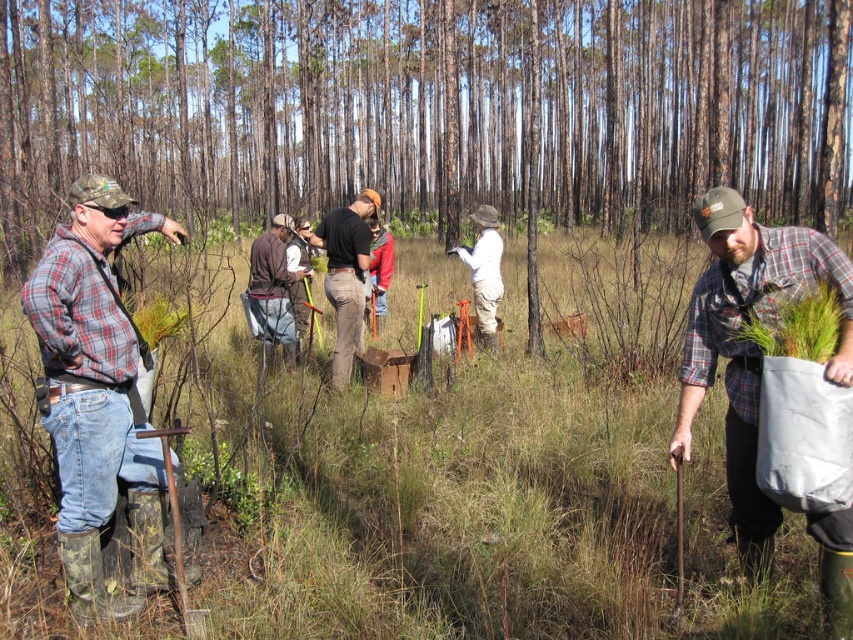
Which of these two, brown wood tree at center or brown leather vest at center, stands shorter?

brown leather vest at center

Can you confirm if brown wood tree at center is bigger than brown leather vest at center?

Correct, brown wood tree at center is larger in size than brown leather vest at center.

Is point (763, 49) farther from camera compared to point (274, 243)?

Yes.

This screenshot has width=853, height=640. I want to click on brown wood tree at center, so click(427, 108).

Which is in front, point (326, 256) or point (296, 358)?

Point (326, 256)

How far apart are brown leather pants at center and brown leather vest at center?

A distance of 31.74 inches exists between brown leather pants at center and brown leather vest at center.

What do you see at coordinates (346, 275) in the screenshot?
I see `brown leather pants at center` at bounding box center [346, 275].

Identify the location of brown leather pants at center. [x=346, y=275].

Who is more forward, (x=840, y=371) or (x=355, y=292)?

Point (x=840, y=371) is more forward.

Based on the photo, is plaid flannel shirt at center shorter than brown leather pants at center?

Indeed, plaid flannel shirt at center has a lesser height compared to brown leather pants at center.

Between point (729, 378) and point (341, 305), which one is positioned in front?

Point (729, 378) is more forward.

Identify the location of plaid flannel shirt at center. (750, 344).